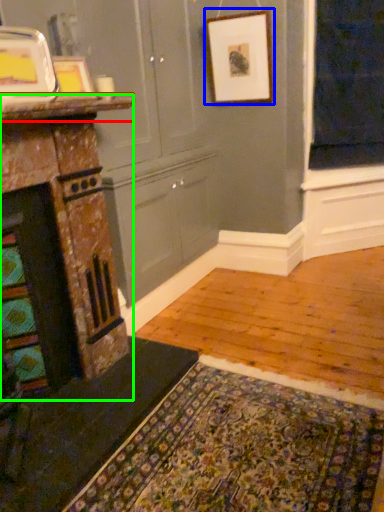
Question: Which object is positioned farthest from counter top (highlighted by a red box)? Select from picture frame (highlighted by a blue box) and fireplace (highlighted by a green box).

Choices:
 (A) picture frame
 (B) fireplace

Answer: (A)